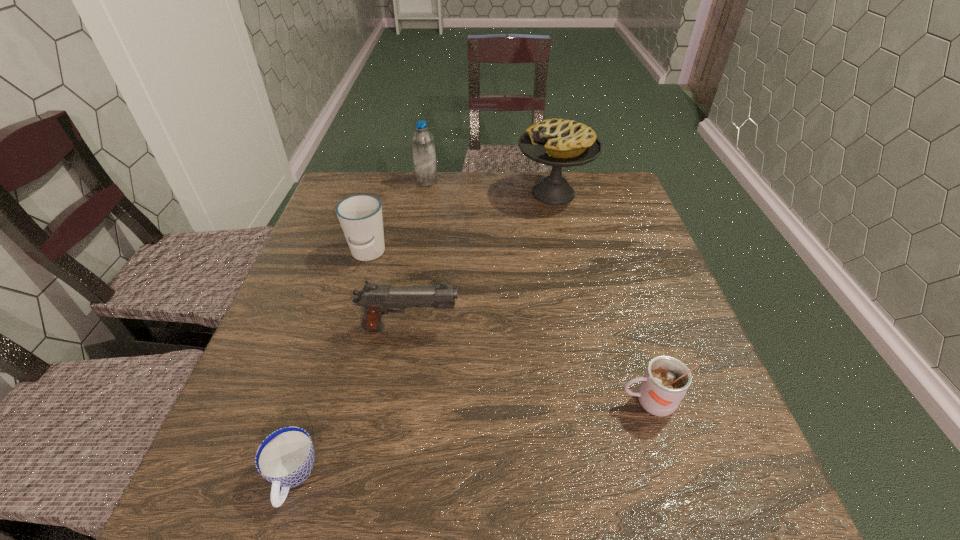
Where is `vacant space located 0.290m on the cut side of the pie`? vacant space located 0.290m on the cut side of the pie is located at coordinates pyautogui.click(x=419, y=193).

You are a GUI agent. You are given a task and a screenshot of the screen. Output one action in this format:
    pyautogui.click(x=<x>, y=<y>)
    Task: Click on the free space located on the cut side of the pie
    This screenshot has height=540, width=960.
    Given the screenshot: What is the action you would take?
    pyautogui.click(x=398, y=193)

Find the location of a particular element. free space located 0.390m on the right of the water bottle is located at coordinates (563, 181).

You are a GUI agent. You are given a task and a screenshot of the screen. Output one action in this format:
    pyautogui.click(x=<x>, y=<y>)
    Task: Click on the vacant point located with a handle on the side of the tallest cup
    
    Given the screenshot: What is the action you would take?
    pyautogui.click(x=355, y=296)

Where is `free spot located 0.120m in the direction the third nearest object is aimed`? The height and width of the screenshot is (540, 960). free spot located 0.120m in the direction the third nearest object is aimed is located at coordinates (516, 328).

Locate an element on the screen. free space located on the side with the handle of the second shortest cup is located at coordinates 433,402.

The image size is (960, 540). I want to click on free location located 0.150m on the side with the handle of the second shortest cup, so pyautogui.click(x=537, y=402).

Find the location of a particular element. free spot located on the side with the handle of the second shortest cup is located at coordinates (569, 402).

Where is `pie that is at the far edge`? This screenshot has width=960, height=540. pie that is at the far edge is located at coordinates (559, 143).

Identify the location of water bottle that is at the far edge. (423, 145).